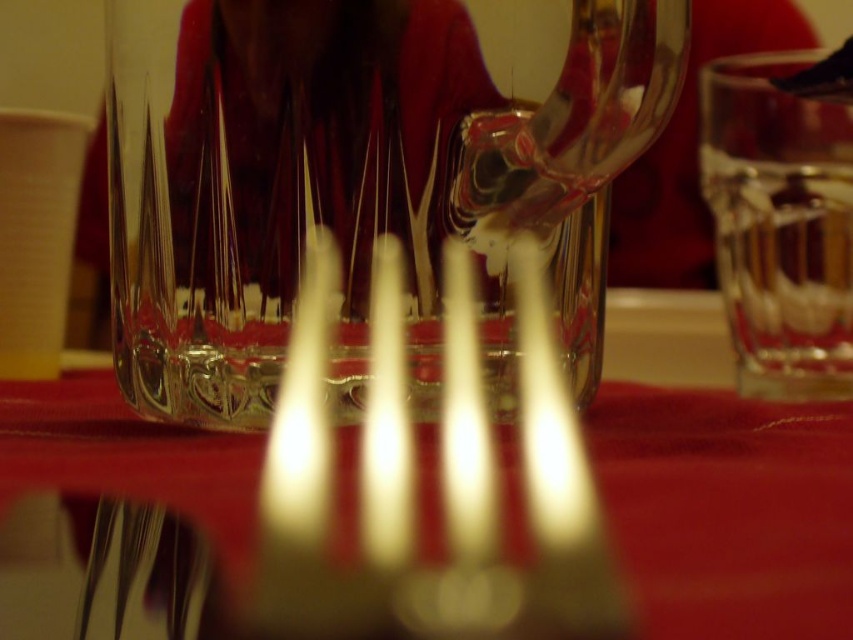
You are setting the table and need to place the clear glass wine glass at center on the red velvet tablecloth at center. Is the glass already resting on the tablecloth?

The clear glass wine glass at center is above red velvet tablecloth at center, so yes, the glass is resting on the tablecloth.

You are setting up a table for a dinner party and need to place the clear glass wine glass at center on the red velvet tablecloth at center. Based on their sizes, will the wine glass fit entirely on the tablecloth without any part hanging off?

The clear glass wine glass at center is much taller than the red velvet tablecloth at center, so the height of the glass may extend above the tablecloth, but the base of the glass should still fit within the tablecloth as the tablecloth covers the table surface. However, the description only mentions height comparison, not width, so the horizontal fit cannot be determined from the given information.